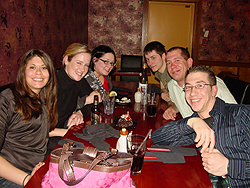
At what (x,y) coordinates should I click in order to perform the action: click on beer bottle. Please return your answer as a coordinate pair (x, y). The width and height of the screenshot is (250, 188). Looking at the image, I should click on (99, 113).